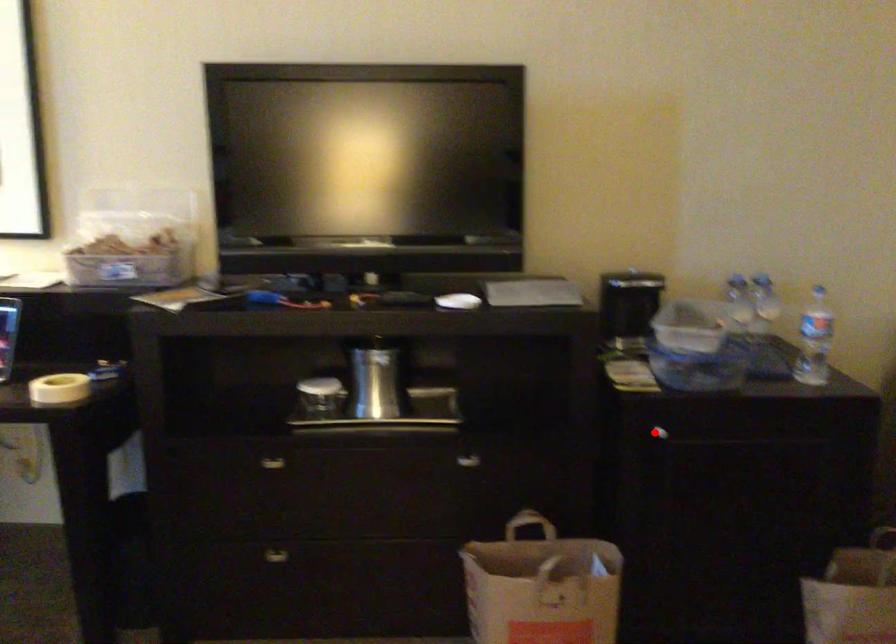
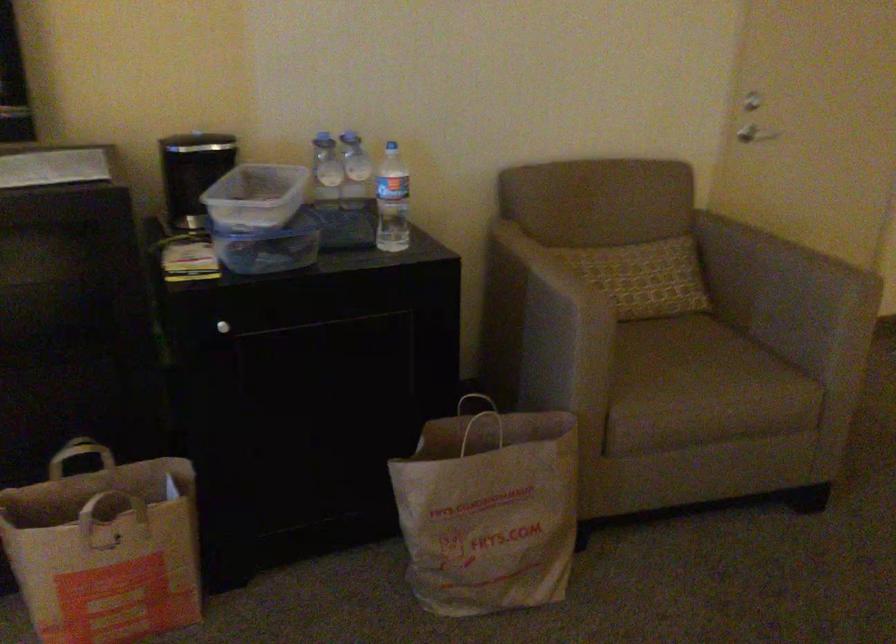
Question: I am providing you with two images of the same scene from different viewpoints. A red point is shown in image1. For the corresponding object point in image2, is it positioned nearer or farther from the camera?

Choices:
 (A) Nearer
 (B) Farther

Answer: (A)